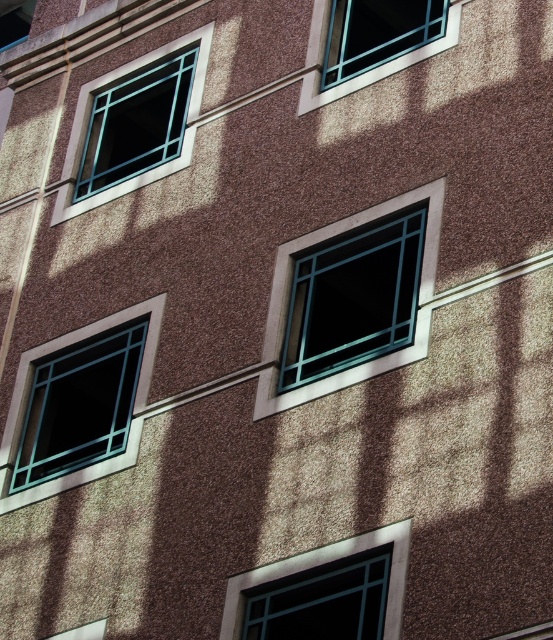
Question: Is green glass window at center in front of teal glass window at upper left?

Choices:
 (A) no
 (B) yes

Answer: (B)

Question: Based on their relative distances, which object is nearer to the teal glass window at upper left?

Choices:
 (A) green glass window at center
 (B) matte teal glass window at upper right
 (C) matte glass window at lower right

Answer: (B)

Question: Which of the following is the closest to the observer?

Choices:
 (A) matte glass window at lower left
 (B) matte teal glass window at upper right
 (C) matte glass window at upper left

Answer: (A)

Question: Observing the image, what is the correct spatial positioning of green glass window at center in reference to matte glass window at upper left?

Choices:
 (A) below
 (B) above

Answer: (A)

Question: Among these objects, which one is farthest from the camera?

Choices:
 (A) teal glass window at upper left
 (B) matte glass window at lower left
 (C) green glass window at center

Answer: (A)

Question: Can you confirm if green glass window at center is positioned to the right of teal glass window at upper left?

Choices:
 (A) yes
 (B) no

Answer: (A)